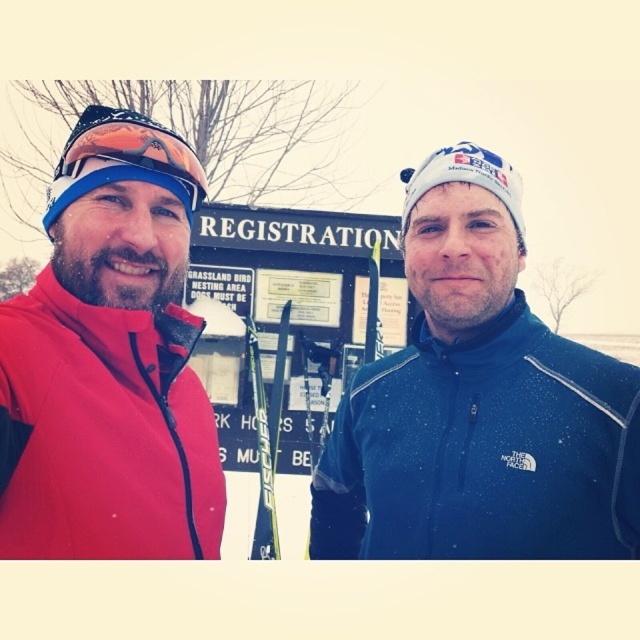
Question: Does blue fleece jacket at center have a lesser width compared to matte red jacket at left?

Choices:
 (A) yes
 (B) no

Answer: (A)

Question: Which object appears closest to the camera in this image?

Choices:
 (A) blue fleece jacket at center
 (B) matte red jacket at left

Answer: (B)

Question: Is blue fleece jacket at center positioned behind matte red jacket at left?

Choices:
 (A) no
 (B) yes

Answer: (B)

Question: Is blue fleece jacket at center bigger than matte red jacket at left?

Choices:
 (A) yes
 (B) no

Answer: (B)

Question: Which point is closer to the camera taking this photo?

Choices:
 (A) (356, 413)
 (B) (120, 324)

Answer: (B)

Question: Which of the following is the closest to the observer?

Choices:
 (A) click(x=502, y=548)
 (B) click(x=212, y=474)

Answer: (A)